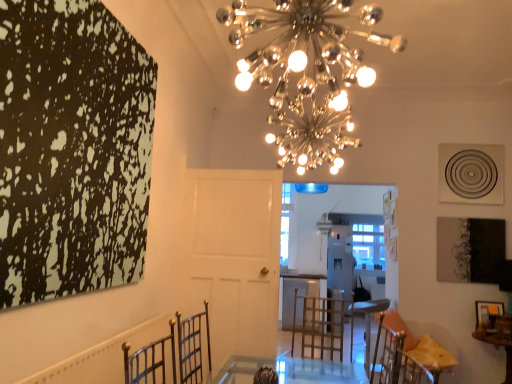
Question: Should I look upward or downward to see metallic gold chair at lower right?

Choices:
 (A) up
 (B) down

Answer: (B)

Question: Considering the relative sizes of wooden table at lower right and wooden picture frame at lower right in the image provided, is wooden table at lower right smaller than wooden picture frame at lower right?

Choices:
 (A) yes
 (B) no

Answer: (B)

Question: Does wooden table at lower right have a lesser height compared to wooden picture frame at lower right?

Choices:
 (A) yes
 (B) no

Answer: (B)

Question: From a real-world perspective, is wooden table at lower right positioned over wooden picture frame at lower right based on gravity?

Choices:
 (A) yes
 (B) no

Answer: (B)

Question: Can we say wooden table at lower right lies outside wooden picture frame at lower right?

Choices:
 (A) yes
 (B) no

Answer: (A)

Question: From the image's perspective, does wooden table at lower right appear higher than wooden picture frame at lower right?

Choices:
 (A) yes
 (B) no

Answer: (B)

Question: Is wooden table at lower right to the right of wooden picture frame at lower right from the viewer's perspective?

Choices:
 (A) no
 (B) yes

Answer: (A)

Question: Is wooden table at lower right thinner than metallic spherical lights at upper center?

Choices:
 (A) no
 (B) yes

Answer: (B)

Question: Can you confirm if wooden table at lower right is bigger than metallic spherical lights at upper center?

Choices:
 (A) no
 (B) yes

Answer: (A)

Question: Considering the relative positions of wooden table at lower right and metallic spherical lights at upper center in the image provided, is wooden table at lower right to the right of metallic spherical lights at upper center from the viewer's perspective?

Choices:
 (A) yes
 (B) no

Answer: (A)

Question: Can you confirm if wooden table at lower right is wider than metallic spherical lights at upper center?

Choices:
 (A) yes
 (B) no

Answer: (B)

Question: Is wooden table at lower right next to metallic spherical lights at upper center and touching it?

Choices:
 (A) no
 (B) yes

Answer: (A)

Question: Considering the relative sizes of wooden table at lower right and metallic spherical lights at upper center in the image provided, is wooden table at lower right taller than metallic spherical lights at upper center?

Choices:
 (A) yes
 (B) no

Answer: (B)

Question: Does metallic gold chair at lower right appear on the right side of wooden picture frame at lower right?

Choices:
 (A) no
 (B) yes

Answer: (A)